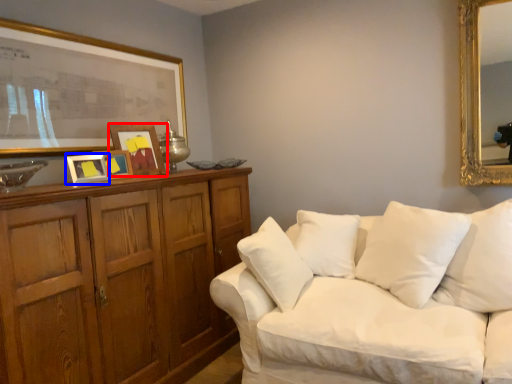
Question: Which point is further to the camera, picture frame (highlighted by a red box) or picture frame (highlighted by a blue box)?

Choices:
 (A) picture frame
 (B) picture frame

Answer: (A)